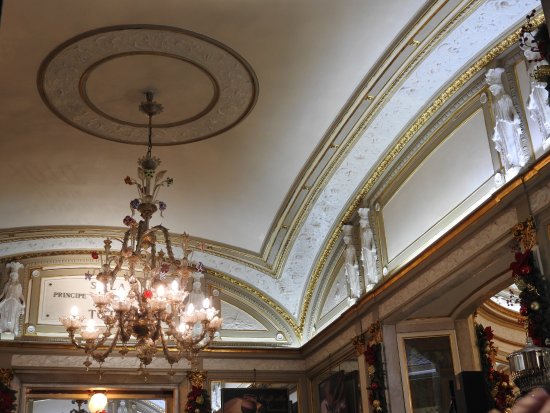
Find the location of a particular element. The height and width of the screenshot is (413, 550). window is located at coordinates (137, 405).